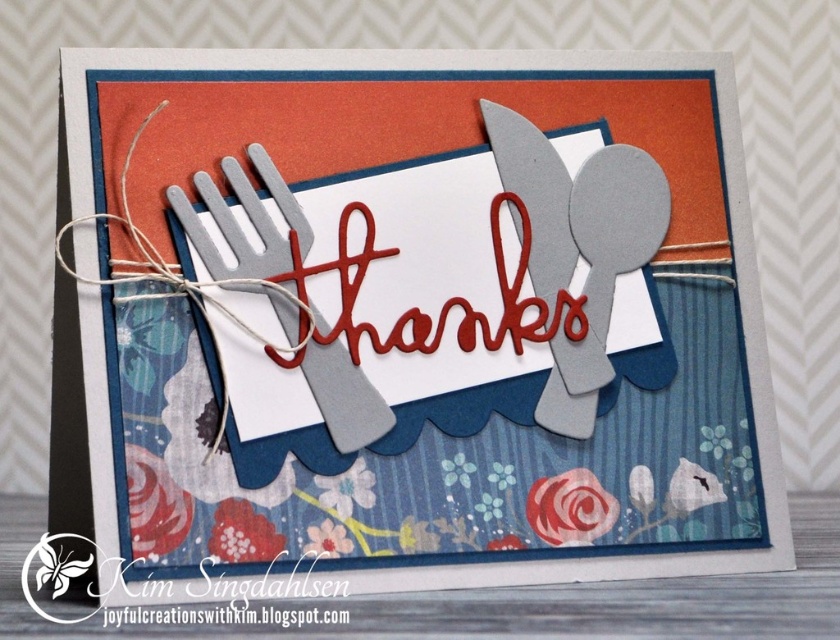
Question: From the image, what is the correct spatial relationship of matte gray fork at center in relation to metallic silver fork at center?

Choices:
 (A) above
 (B) below

Answer: (B)

Question: Which object is positioned farthest from the metallic silver fork at center?

Choices:
 (A) metallic silver spoon at upper right
 (B) matte gray utensils at center
 (C) matte gray fork at center

Answer: (C)

Question: Which is nearer to the matte gray utensils at center?

Choices:
 (A) matte gray fork at center
 (B) metallic silver spoon at upper right

Answer: (A)

Question: Is matte gray fork at center closer to camera compared to metallic silver spoon at upper right?

Choices:
 (A) no
 (B) yes

Answer: (B)

Question: Is matte gray utensils at center further to the viewer compared to matte gray fork at center?

Choices:
 (A) yes
 (B) no

Answer: (B)

Question: Which object is the closest to the matte gray utensils at center?

Choices:
 (A) matte gray fork at center
 (B) metallic silver fork at center
 (C) metallic silver spoon at upper right

Answer: (A)